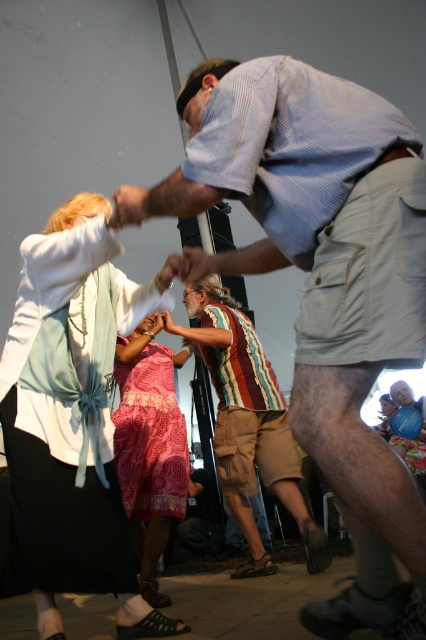
Which of these two, blue striped shirt at upper center or pink fabric dress at center, stands taller?

With more height is blue striped shirt at upper center.

Does blue striped shirt at upper center have a greater height compared to pink fabric dress at center?

Yes, blue striped shirt at upper center is taller than pink fabric dress at center.

Who is more forward, (368, 554) or (386, 413)?

Positioned in front is point (368, 554).

Find the location of a particular element. blue striped shirt at upper center is located at coordinates (321, 260).

Does light blue fabric at upper left lie behind smooth skin hand at center?

That is False.

Is light blue fabric at upper left in front of smooth skin hand at center?

Yes, light blue fabric at upper left is closer to the viewer.

Find the location of a particular element. This screenshot has height=640, width=426. light blue fabric at upper left is located at coordinates (72, 416).

Is blue striped shirt at upper center bigger than smooth skin hand at center?

Yes.

Who is shorter, blue striped shirt at upper center or smooth skin hand at center?

smooth skin hand at center

Find the location of a particular element. blue striped shirt at upper center is located at coordinates (321, 260).